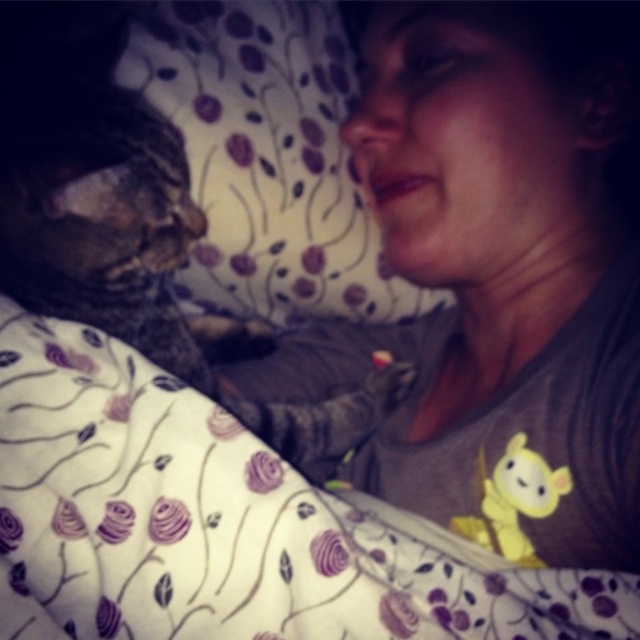
Can you confirm if fluffy white blanket at lower left is positioned to the right of fluffy fabric pillow at upper left?

Incorrect, fluffy white blanket at lower left is not on the right side of fluffy fabric pillow at upper left.

Is fluffy white blanket at lower left positioned behind fluffy fabric pillow at upper left?

No, it is in front of fluffy fabric pillow at upper left.

This screenshot has width=640, height=640. What do you see at coordinates (225, 524) in the screenshot?
I see `fluffy white blanket at lower left` at bounding box center [225, 524].

Where is `fluffy white blanket at lower left`? The image size is (640, 640). fluffy white blanket at lower left is located at coordinates coord(225,524).

Locate an element on the screen. This screenshot has width=640, height=640. fluffy fabric pillow at upper left is located at coordinates (268, 157).

Who is positioned more to the right, fluffy fabric pillow at upper left or tabby fur cat at left?

Positioned to the right is fluffy fabric pillow at upper left.

Is point (236, 76) more distant than point (131, 131)?

Yes.

Locate an element on the screen. fluffy fabric pillow at upper left is located at coordinates (268, 157).

What do you see at coordinates (225, 524) in the screenshot?
I see `fluffy white blanket at lower left` at bounding box center [225, 524].

Who is shorter, fluffy white blanket at lower left or tabby fur cat at left?

fluffy white blanket at lower left is shorter.

I want to click on fluffy white blanket at lower left, so click(225, 524).

Where is `fluffy white blanket at lower left`? The width and height of the screenshot is (640, 640). fluffy white blanket at lower left is located at coordinates (225, 524).